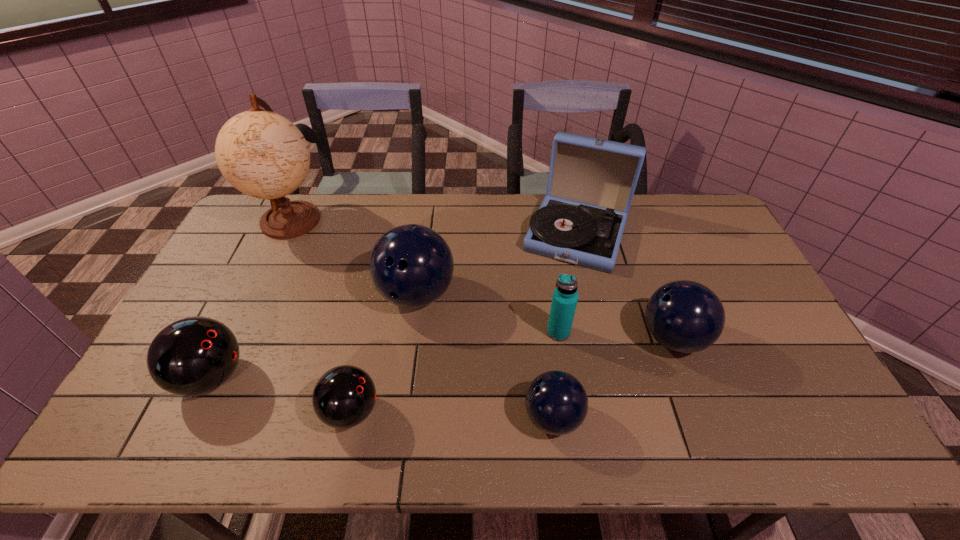
Find the location of a particular element. This screenshot has width=960, height=540. vacant space that satisfies the following two spatial constraints: 1. on the front side of the seventh shortest object; 2. on the surface of the smaller black bowling ball near the finger holes is located at coordinates (619, 411).

The image size is (960, 540). Find the location of `free space that satisfies the following two spatial constraints: 1. on the surface of the biggest blue bowling ball near the finger holes; 2. on the left side of the water bottle`. free space that satisfies the following two spatial constraints: 1. on the surface of the biggest blue bowling ball near the finger holes; 2. on the left side of the water bottle is located at coordinates (411, 332).